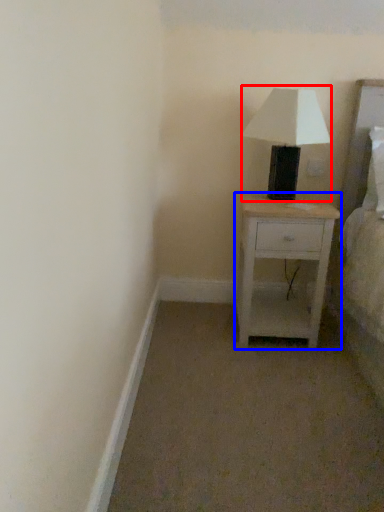
Question: Which of the following is the closest to the observer, table lamp (highlighted by a red box) or nightstand (highlighted by a blue box)?

Choices:
 (A) table lamp
 (B) nightstand

Answer: (A)